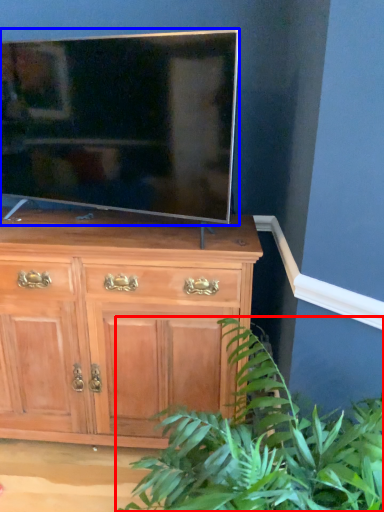
Question: Which of the following is the farthest to the observer, houseplant (highlighted by a red box) or television (highlighted by a blue box)?

Choices:
 (A) houseplant
 (B) television

Answer: (B)